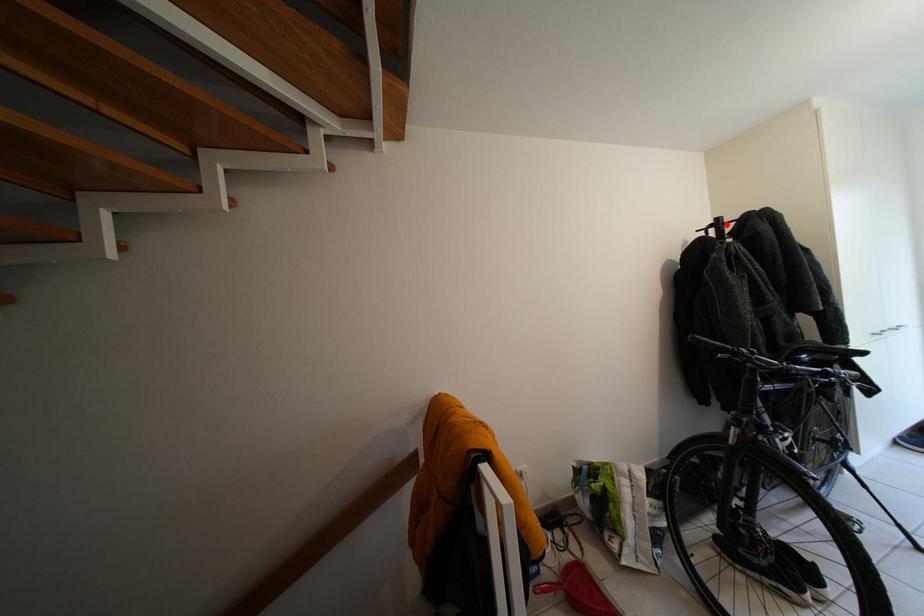
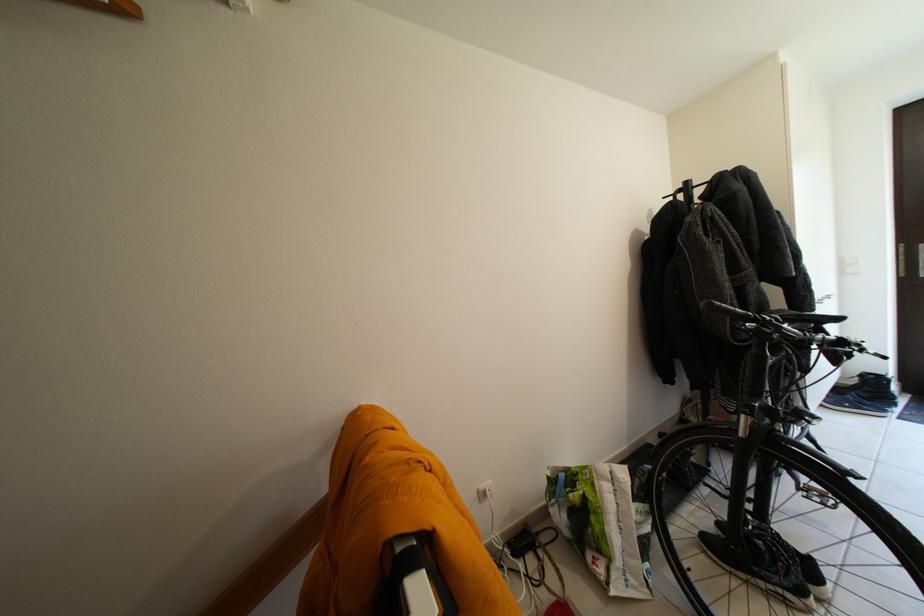
Find the pixel in the second image that matches the highlighted location in the first image.

(696, 188)